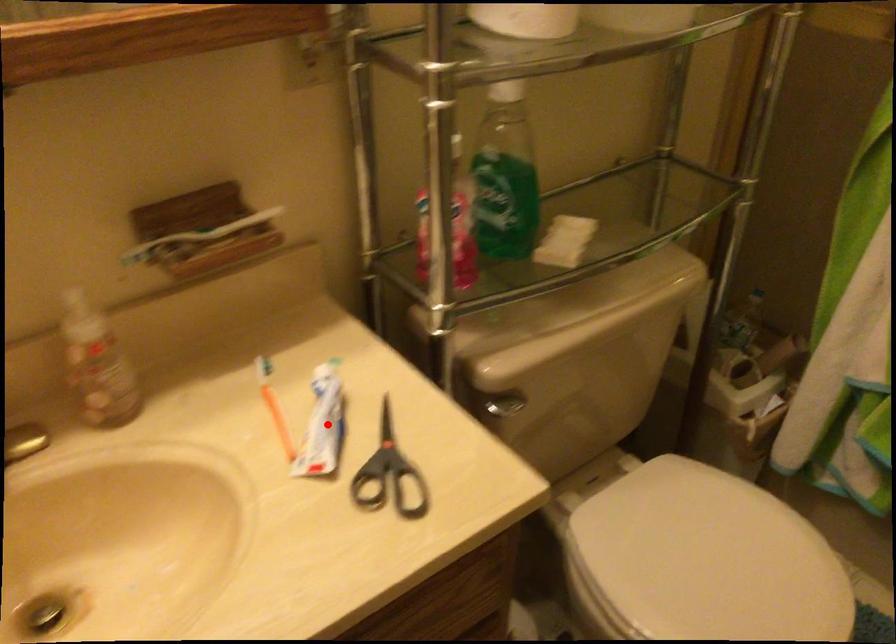
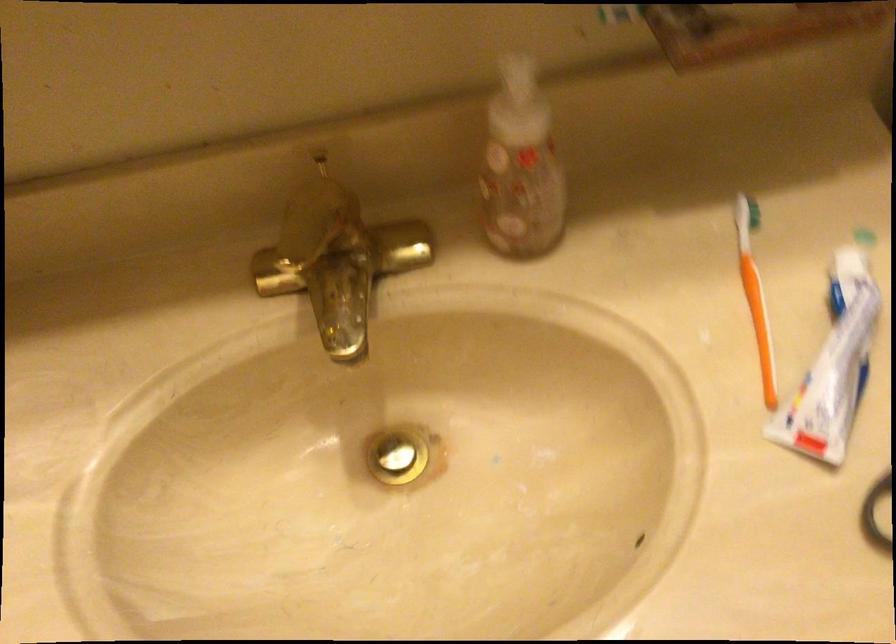
Question: I am providing you with two images of the same scene from different viewpoints. In image1, a red point is highlighted. Considering the same 3D point in image2, which of the following is correct?

Choices:
 (A) It is closer
 (B) It is farther

Answer: (A)